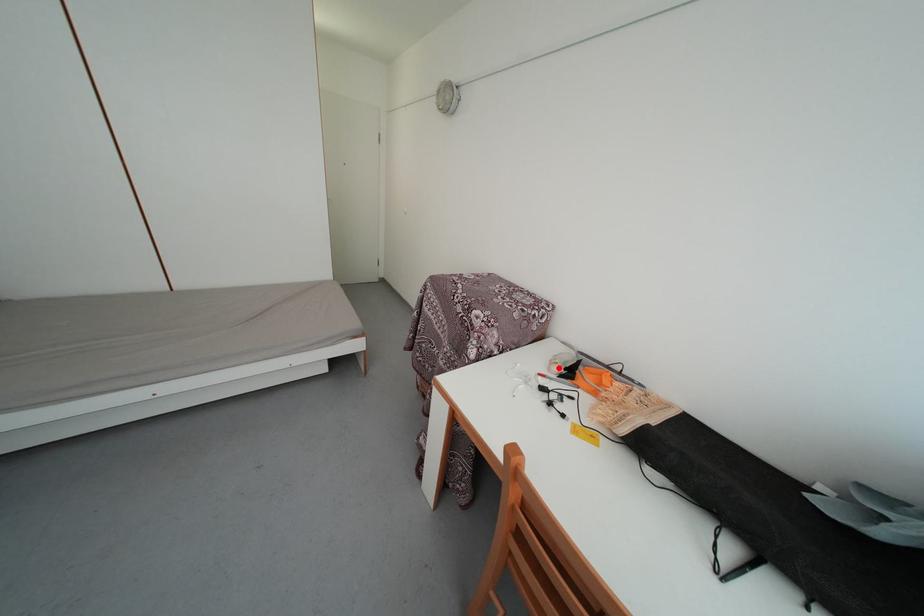
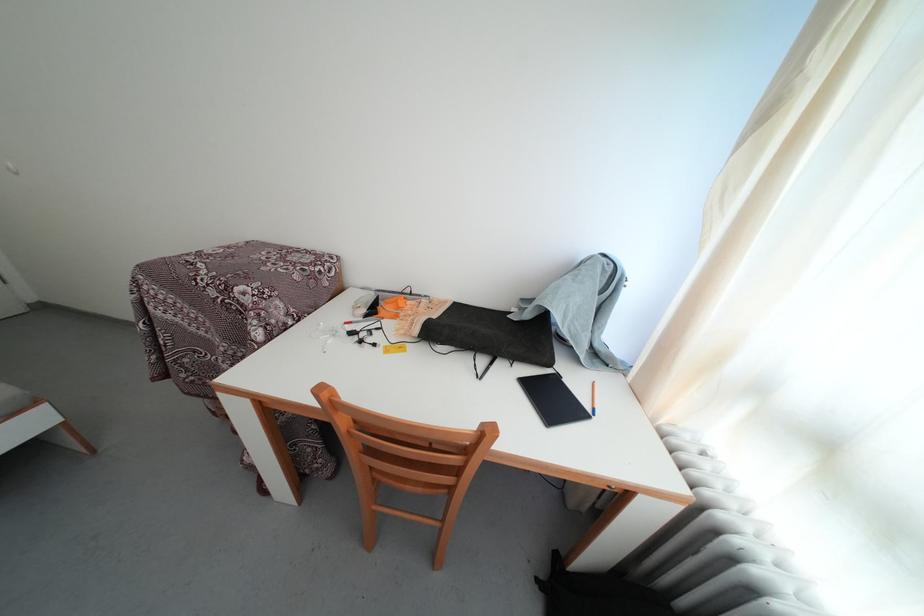
Find the pixel in the second image that matches the highlighted location in the first image.

(361, 314)